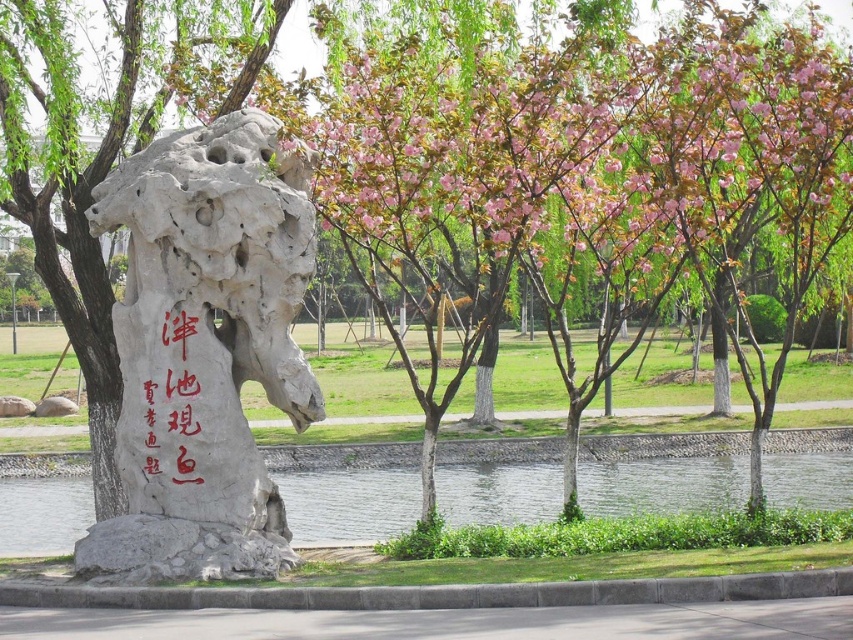
Can you confirm if natural stone rock at center is positioned below red calligraphy stone at center?

Incorrect, natural stone rock at center is not positioned below red calligraphy stone at center.

Who is more distant from viewer, (251, 573) or (196, 372)?

Positioned behind is point (196, 372).

Is point (265, 515) positioned after point (189, 349)?

Yes, it is behind point (189, 349).

This screenshot has width=853, height=640. In order to click on natural stone rock at center in this screenshot , I will do `click(204, 349)`.

Is natural stone rock at center positioned before clear water at center?

That is True.

In the scene shown: Can you confirm if natural stone rock at center is bigger than clear water at center?

Actually, natural stone rock at center might be smaller than clear water at center.

Where is `natural stone rock at center`? natural stone rock at center is located at coordinates (204, 349).

Between point (33, 513) and point (160, 330), which one is positioned in front?

Point (160, 330)

Does clear water at center appear on the right side of red calligraphy stone at center?

Yes, clear water at center is to the right of red calligraphy stone at center.

Is point (836, 464) farther from viewer compared to point (212, 388)?

That is True.

Locate an element on the screen. This screenshot has height=640, width=853. clear water at center is located at coordinates (349, 504).